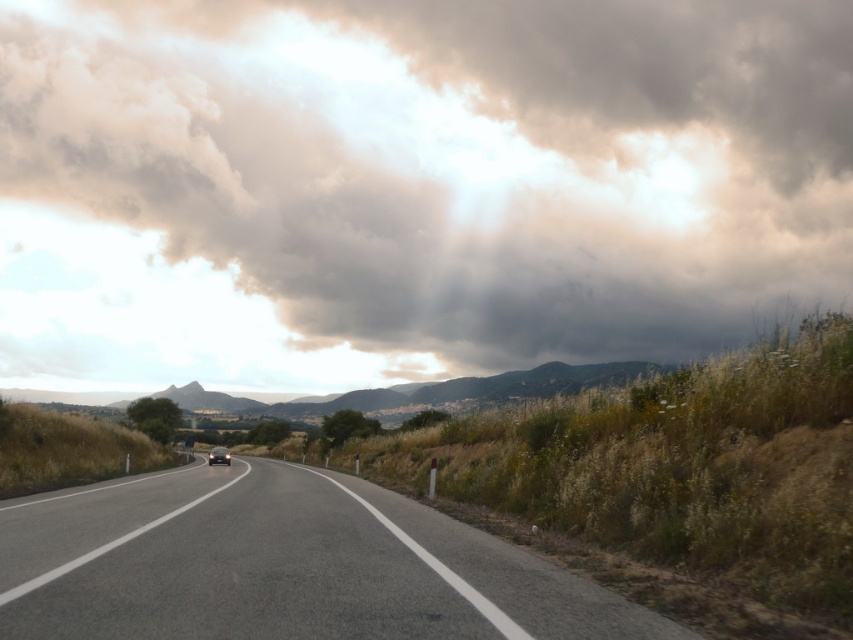
Is gray fluffy cloud at upper center closer to camera compared to asphalt road at center?

No, it is not.

Measure the distance between point (x=186, y=195) and camera.

They are 428.76 feet apart.

Between point (273, 33) and point (558, 582), which one is positioned behind?

Positioned behind is point (273, 33).

This screenshot has width=853, height=640. I want to click on gray fluffy cloud at upper center, so click(456, 163).

Which of these two, asphalt road at center or shiny black car at center, stands taller?

shiny black car at center

The image size is (853, 640). I want to click on asphalt road at center, so click(x=282, y=566).

Where is `asphalt road at center`? asphalt road at center is located at coordinates (282, 566).

Is gray fluffy cloud at upper center smaller than shiny black car at center?

Actually, gray fluffy cloud at upper center might be larger than shiny black car at center.

Can you confirm if gray fluffy cloud at upper center is positioned below shiny black car at center?

Actually, gray fluffy cloud at upper center is above shiny black car at center.

Who is more distant from viewer, (593, 321) or (209, 460)?

The point (593, 321) is behind.

Where is `gray fluffy cloud at upper center`? Image resolution: width=853 pixels, height=640 pixels. gray fluffy cloud at upper center is located at coordinates (456, 163).